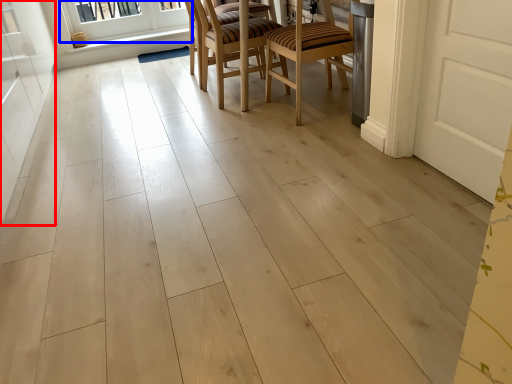
Question: Which of the following is the closest to the observer, screen door (highlighted by a red box) or window (highlighted by a blue box)?

Choices:
 (A) screen door
 (B) window

Answer: (A)